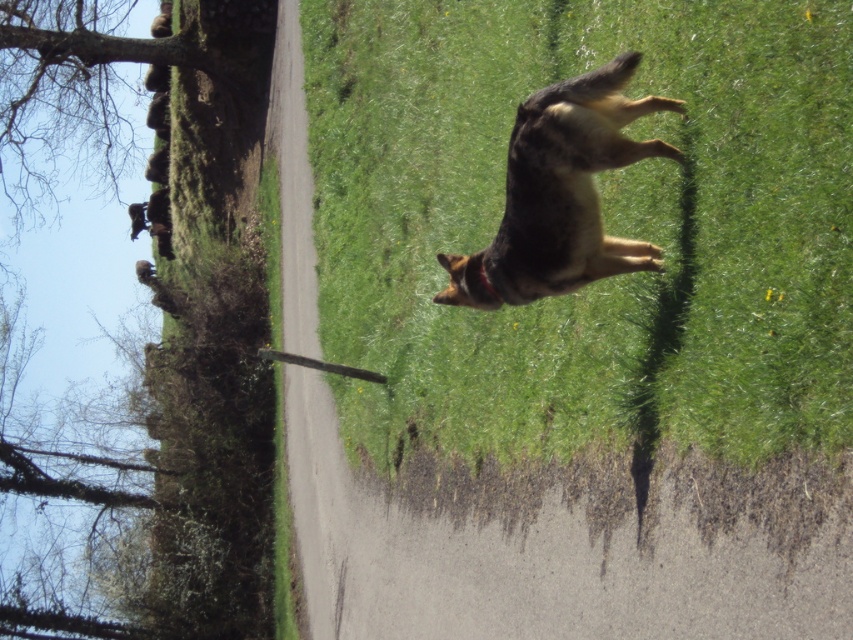
You are a photographer trying to capture the perfect shot of the dark brown fur dog at center. Based on its current position at coordinates 0.303, 0.658, where should you aim your camera to ensure the dog is centered in your shot?

To center the dark brown fur dog at center in your shot, aim your camera at its current coordinates of [560,193] since that is where it is located in the image.

In the scene shown: You are a photographer trying to capture the German Shepherd dog in midair. You notice the green grass at upper right and the dark brown fur dog at center. Which object is bigger in the photo?

The green grass at upper right is larger in size compared to the dark brown fur dog at center according to the description.